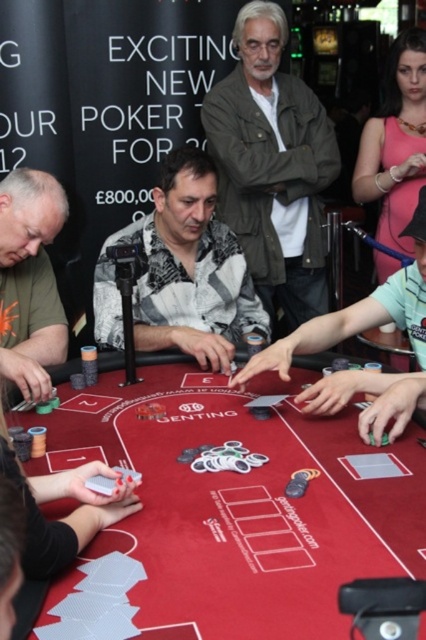
Question: In this image, where is grayish-green textured jacket at upper center located relative to matte green t-shirt at left?

Choices:
 (A) below
 (B) above

Answer: (B)

Question: In this image, where is rubberized felt poker table at center located relative to matte black shirt at center?

Choices:
 (A) above
 (B) below

Answer: (B)

Question: Among these objects, which one is farthest from the camera?

Choices:
 (A) matte green t-shirt at left
 (B) printed cotton shirt at center
 (C) grayish-green textured jacket at upper center
 (D) matte black shirt at center

Answer: (C)

Question: Can you confirm if matte black shirt at center is thinner than matte green t-shirt at left?

Choices:
 (A) yes
 (B) no

Answer: (B)

Question: Estimate the real-world distances between objects in this image. Which object is closer to the matte black shirt at center?

Choices:
 (A) grayish-green textured jacket at upper center
 (B) printed cotton shirt at center
 (C) matte green t-shirt at left
 (D) rubberized felt poker table at center

Answer: (D)

Question: Which object is positioned farthest from the rubberized felt poker table at center?

Choices:
 (A) matte black shirt at center
 (B) grayish-green textured jacket at upper center

Answer: (B)